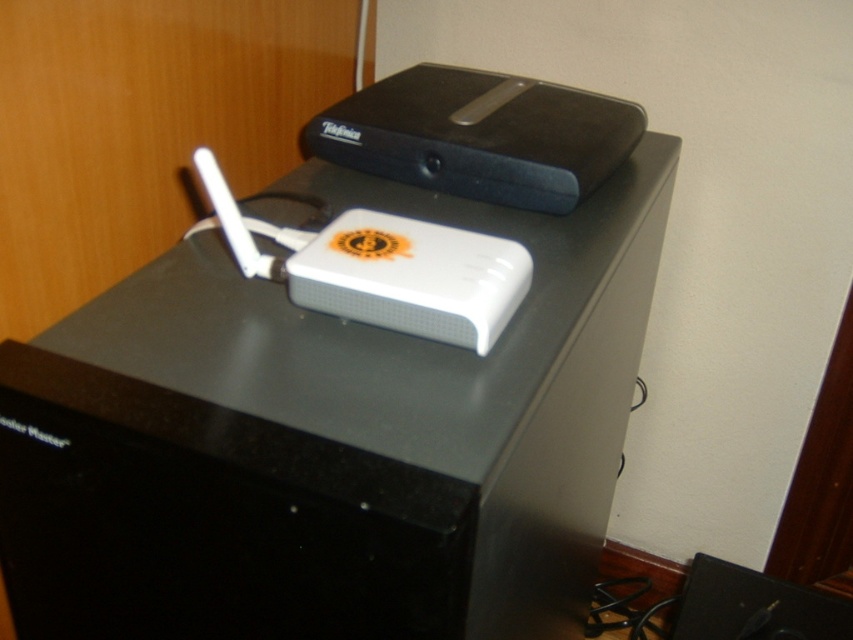
Question: Can you confirm if white plastic router at center is bigger than black plastic speaker at lower right?

Choices:
 (A) yes
 (B) no

Answer: (A)

Question: Where is white plastic router at center located in relation to black plastic speaker at lower right in the image?

Choices:
 (A) left
 (B) right

Answer: (A)

Question: Observing the image, what is the correct spatial positioning of white plastic router at center in reference to black plastic speaker at lower right?

Choices:
 (A) right
 (B) left

Answer: (B)